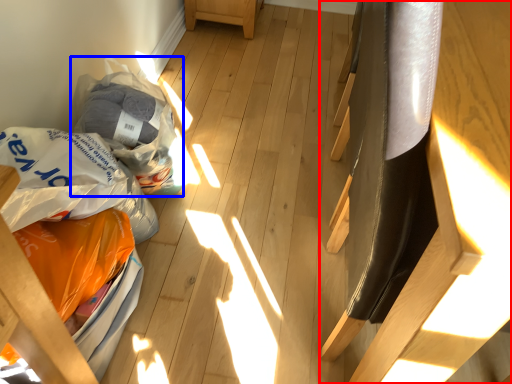
Question: Which object is further to the camera taking this photo, furniture (highlighted by a red box) or grocery bag (highlighted by a blue box)?

Choices:
 (A) furniture
 (B) grocery bag

Answer: (B)